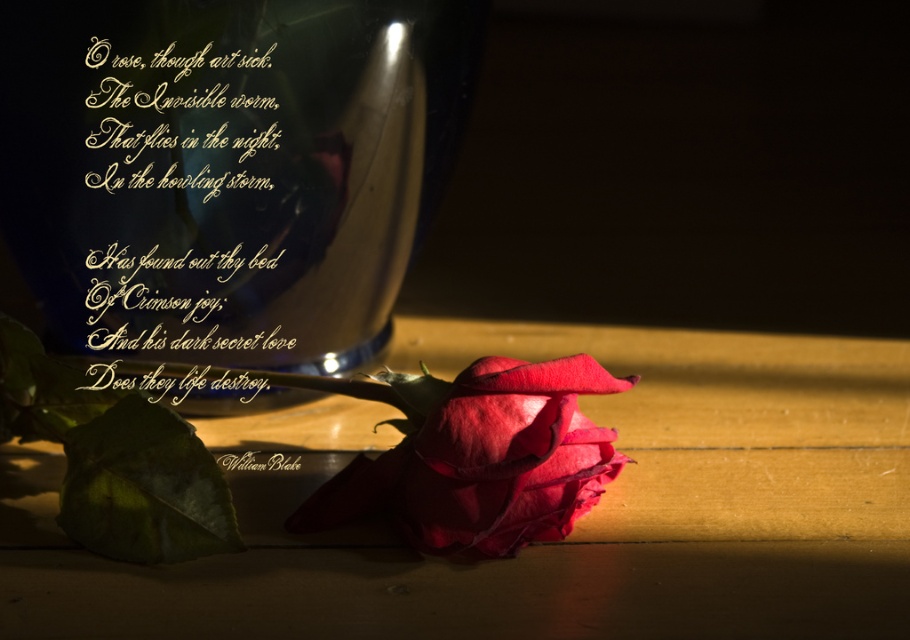
Is point (718, 492) positioned in front of point (410, 470)?

No.

The width and height of the screenshot is (910, 640). What do you see at coordinates (544, 545) in the screenshot? I see `wooden table at lower center` at bounding box center [544, 545].

Where is `wooden table at lower center`? wooden table at lower center is located at coordinates (544, 545).

Can you confirm if glossy glass vase at upper center is positioned to the left of gold calligraphy at upper left?

Incorrect, glossy glass vase at upper center is not on the left side of gold calligraphy at upper left.

Does glossy glass vase at upper center appear on the right side of gold calligraphy at upper left?

Correct, you'll find glossy glass vase at upper center to the right of gold calligraphy at upper left.

Which is behind, point (15, 179) or point (201, 220)?

Point (201, 220)

Find the location of a particular element. Image resolution: width=910 pixels, height=640 pixels. glossy glass vase at upper center is located at coordinates (228, 168).

Consider the image. Who is positioned more to the right, glossy glass vase at upper center or crimson velvet rose at center?

crimson velvet rose at center is more to the right.

Who is lower down, glossy glass vase at upper center or crimson velvet rose at center?

crimson velvet rose at center is lower down.

Where is `glossy glass vase at upper center`? The width and height of the screenshot is (910, 640). glossy glass vase at upper center is located at coordinates coord(228,168).

Image resolution: width=910 pixels, height=640 pixels. What are the coordinates of `glossy glass vase at upper center` in the screenshot? It's located at (228, 168).